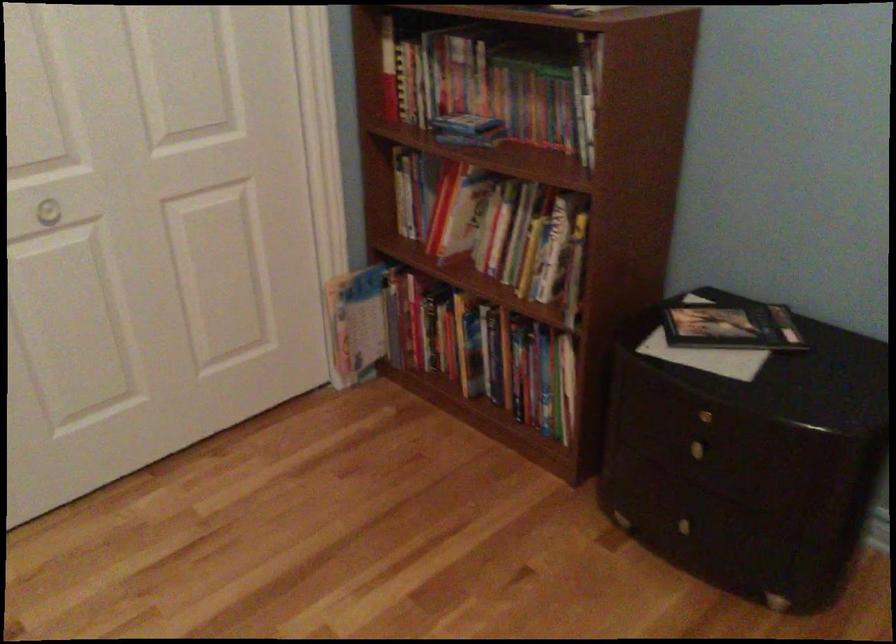
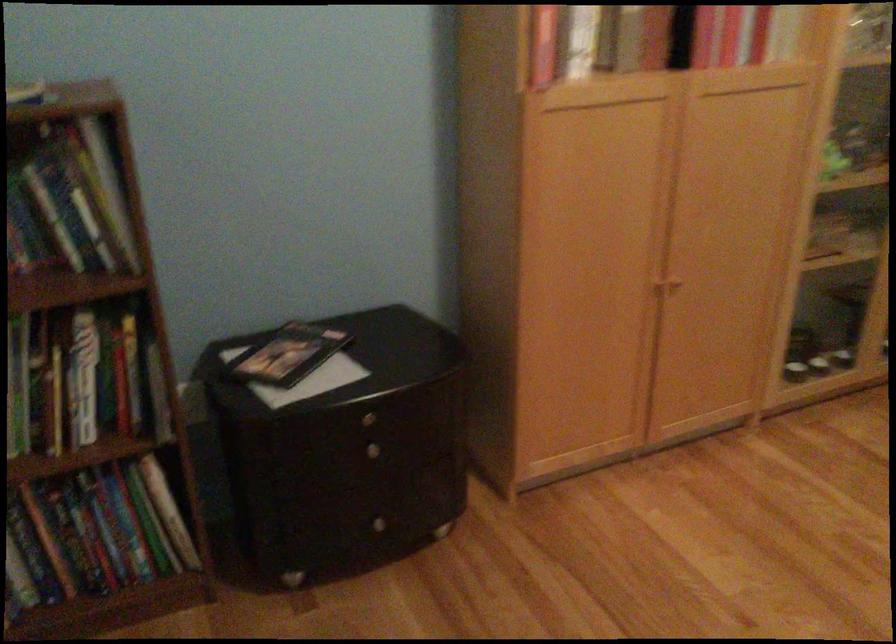
Question: The camera is either moving clockwise (left) or counter-clockwise (right) around the object. The first image is from the beginning of the video and the second image is from the end. Is the camera moving left or right when shooting the video?

Choices:
 (A) Left
 (B) Right

Answer: (A)